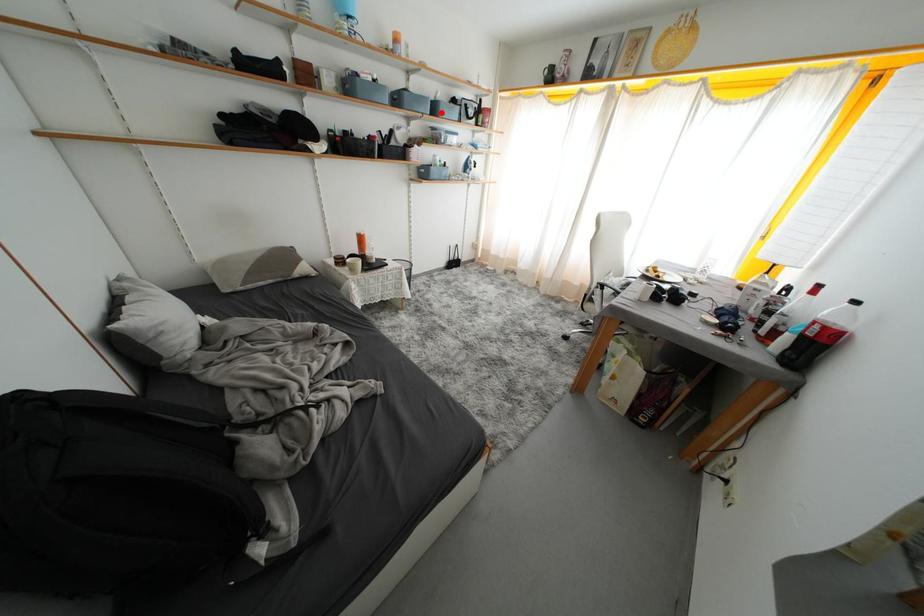
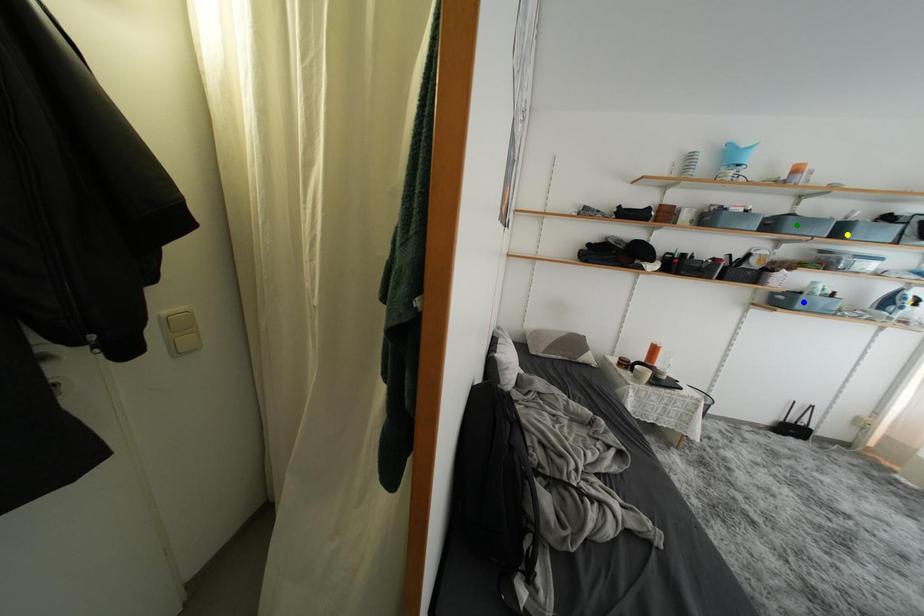
Question: I am providing you with two images of the same scene from different viewpoints. A red point is marked on the first image. You are given multiple points on the second image. Which spot in image 2 lines up with the point in image 1?

Choices:
 (A) yellow point
 (B) green point
 (C) blue point

Answer: (A)